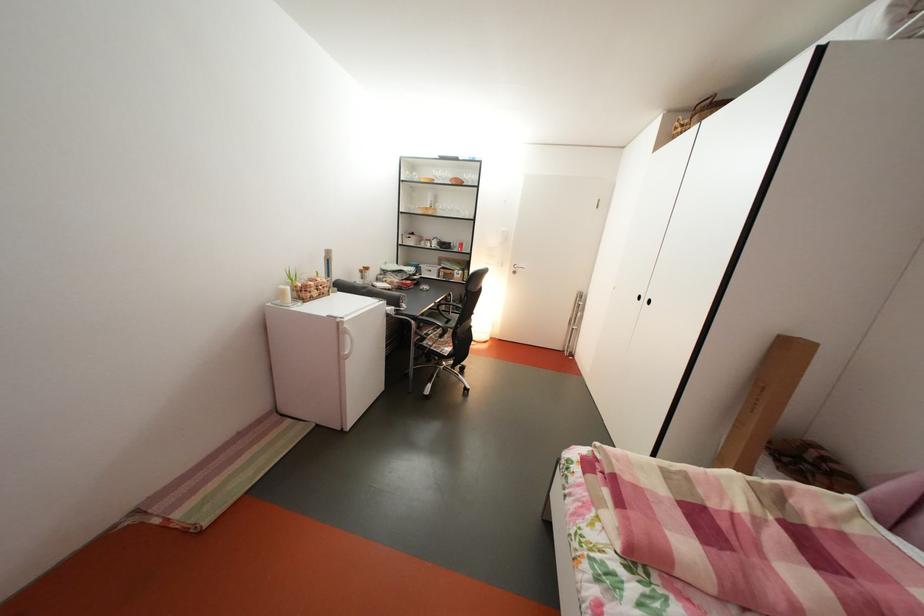
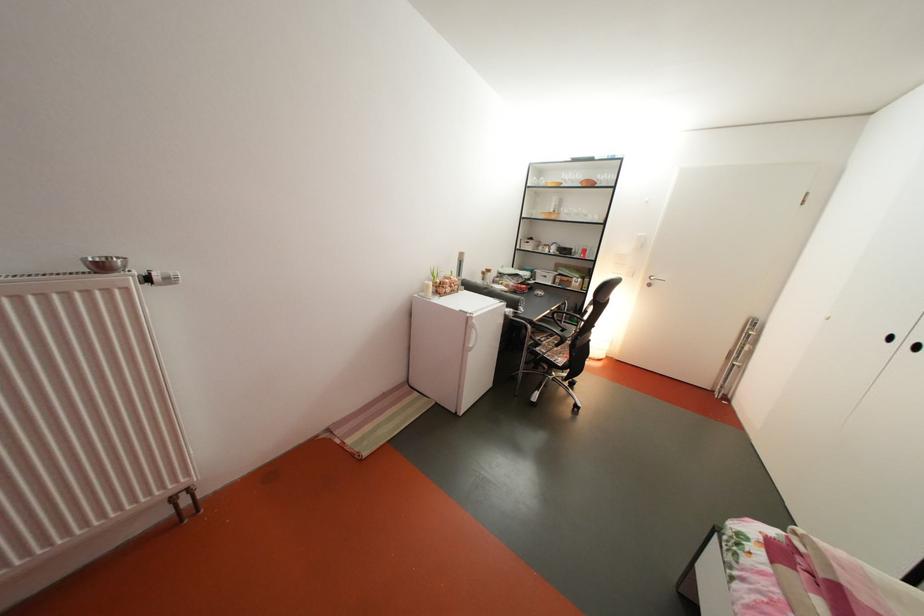
The point at (x=295, y=298) is marked in the first image. Where is the corresponding point in the second image?

(439, 293)